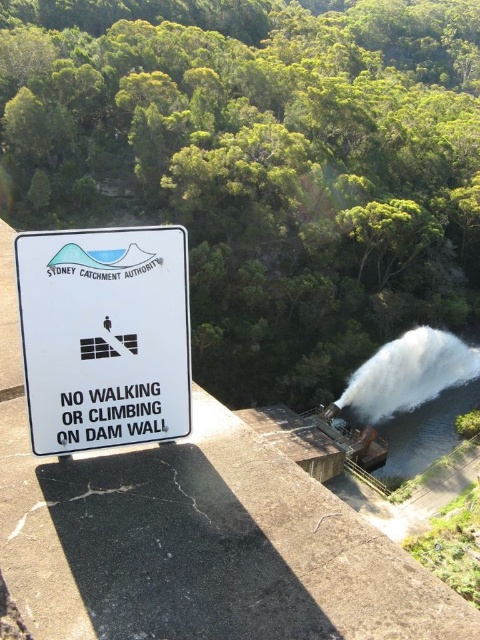
The height and width of the screenshot is (640, 480). What do you see at coordinates (105, 337) in the screenshot?
I see `white plastic sign at center` at bounding box center [105, 337].

Does white plastic sign at center have a lesser height compared to white frothy water at center?

Indeed, white plastic sign at center has a lesser height compared to white frothy water at center.

The width and height of the screenshot is (480, 640). Find the location of `white plastic sign at center`. white plastic sign at center is located at coordinates (105, 337).